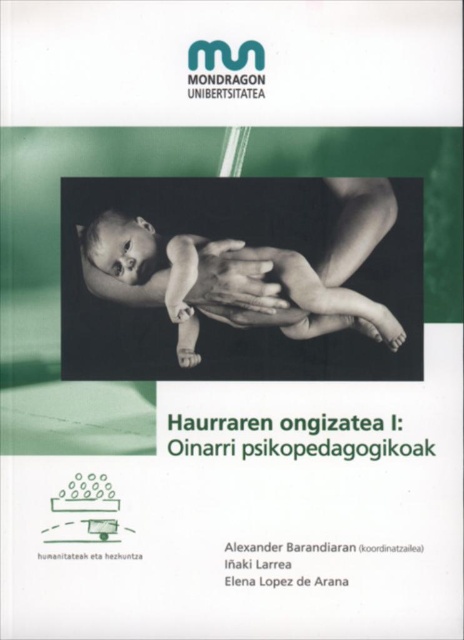
Question: Considering the relative positions of smooth skin baby at center and matte skin hand at center in the image provided, where is smooth skin baby at center located with respect to matte skin hand at center?

Choices:
 (A) below
 (B) above

Answer: (A)

Question: Does smooth skin baby at center appear on the right side of matte skin hand at center?

Choices:
 (A) no
 (B) yes

Answer: (A)

Question: Can you confirm if smooth skin baby at center is bigger than matte skin hand at center?

Choices:
 (A) yes
 (B) no

Answer: (A)

Question: Among these points, which one is farthest from the camera?

Choices:
 (A) 182,285
 (B) 234,291

Answer: (B)